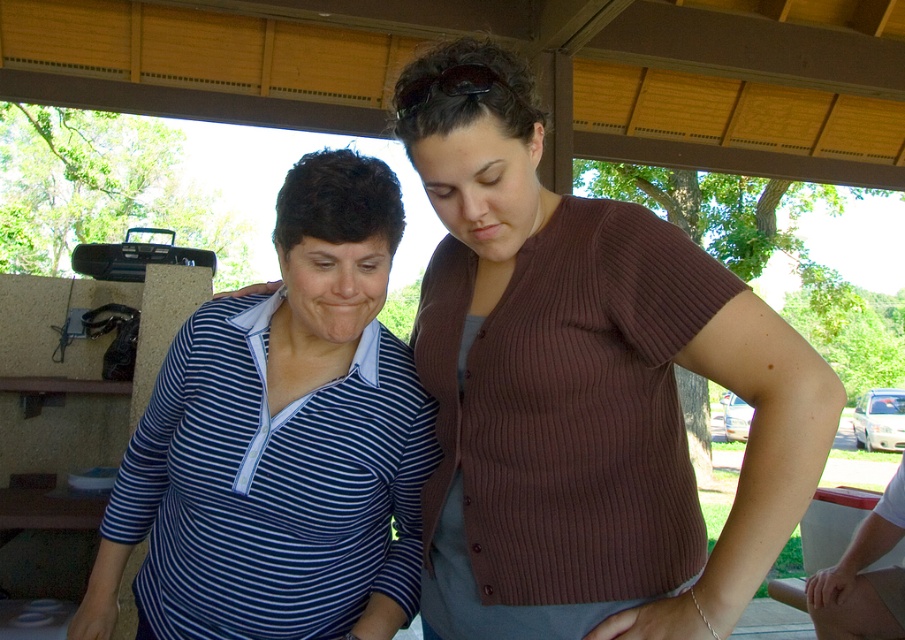
In the scene shown: You are a fashion designer observing two outfits in the image. The striped knit sweater at center and the blue striped shirt at center are both at the center of the image. Which one has a narrower width?

The striped knit sweater at center has a narrower width than the blue striped shirt at center according to the description.

You are a photographer trying to capture both the striped knit sweater at center and the blue striped shirt at center in a single frame. Given their height difference, which one should you focus on to ensure both are fully visible in the photo?

The striped knit sweater at center is much taller than the blue striped shirt at center, so focusing on the striped knit sweater at center would allow you to capture both in the frame since it is taller and requires more vertical space.